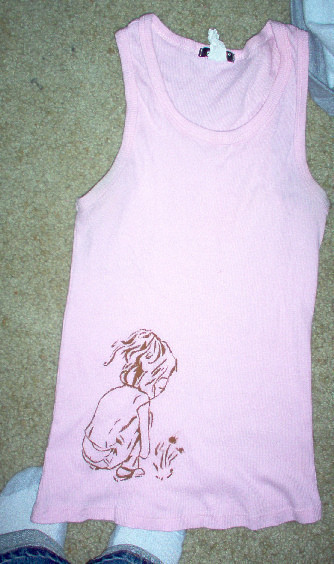
Locate an element on the screen. tan colored carpet is located at coordinates (70, 103).